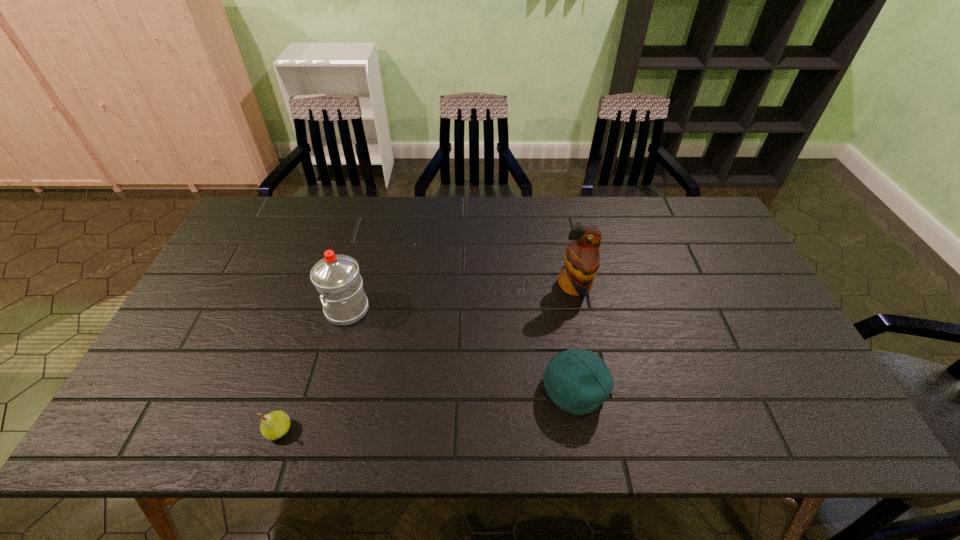
Locate an element on the screen. Image resolution: width=960 pixels, height=540 pixels. free space that satisfies the following two spatial constraints: 1. on the face of the parrot; 2. on the handle side of the water bottle is located at coordinates (580, 309).

Find the location of a particular element. vacant space that satisfies the following two spatial constraints: 1. on the handle side of the water bottle; 2. on the back side of the beanie is located at coordinates (325, 389).